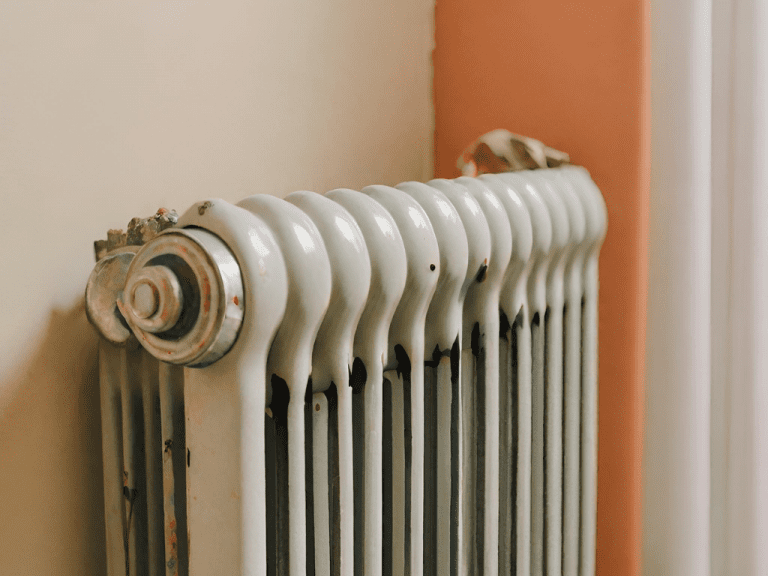
This screenshot has height=576, width=768. What are the coordinates of `rod` in the screenshot? It's located at (220, 336).